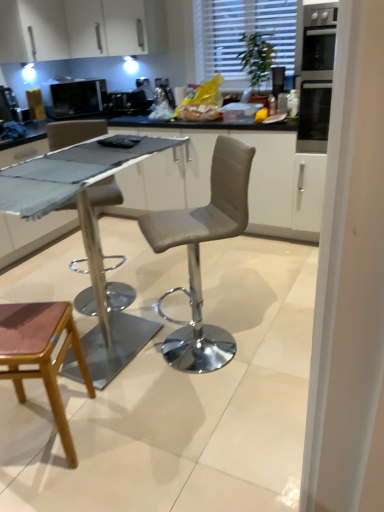
Find the location of a particular element. Image resolution: width=384 pixels, height=512 pixels. free region under dark gray fabric-covered table at center (from a real-world perspective) is located at coordinates tap(122, 348).